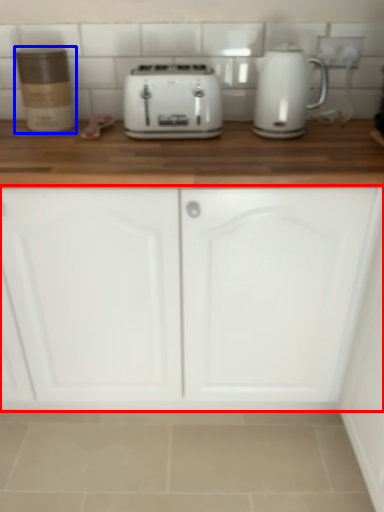
Question: Which object appears farthest to the camera in this image, cabinetry (highlighted by a red box) or kitchen appliance (highlighted by a blue box)?

Choices:
 (A) cabinetry
 (B) kitchen appliance

Answer: (B)